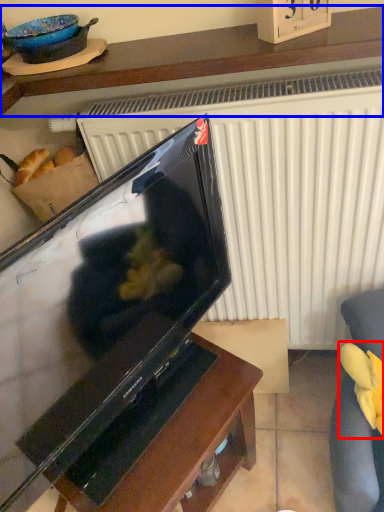
Question: Which object appears farthest to the camera in this image, food (highlighted by a red box) or furniture (highlighted by a blue box)?

Choices:
 (A) food
 (B) furniture

Answer: (A)